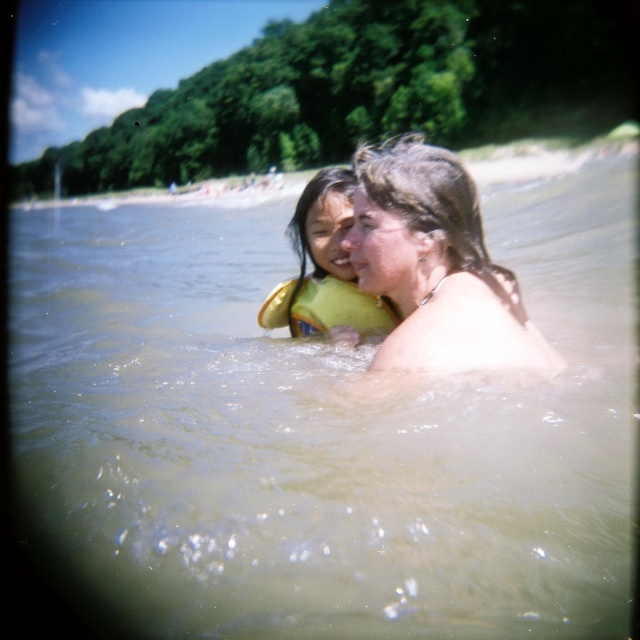
Who is lower down, matte skin woman at center or yellow life vest at center?

matte skin woman at center is lower down.

Is matte skin woman at center bigger than yellow life vest at center?

No, matte skin woman at center is not bigger than yellow life vest at center.

Does point (474, 234) lie behind point (355, 323)?

No, (474, 234) is closer to viewer.

At what (x,y) coordinates should I click in order to perform the action: click on matte skin woman at center. Please return your answer as a coordinate pair (x, y). Looking at the image, I should click on (435, 268).

What do you see at coordinates (435, 268) in the screenshot?
I see `matte skin woman at center` at bounding box center [435, 268].

Is point (435, 237) positioned in front of point (342, 296)?

Yes, it is.

In order to click on matte skin woman at center in this screenshot , I will do `click(435, 268)`.

Locate an element on the screen. The height and width of the screenshot is (640, 640). matte skin woman at center is located at coordinates (435, 268).

Does yellow life vest at center come behind yellow fabric life jacket at center?

No, yellow life vest at center is closer to the viewer.

Does point (289, 304) come behind point (337, 323)?

Yes.

Locate an element on the screen. This screenshot has height=640, width=640. yellow life vest at center is located at coordinates (324, 268).